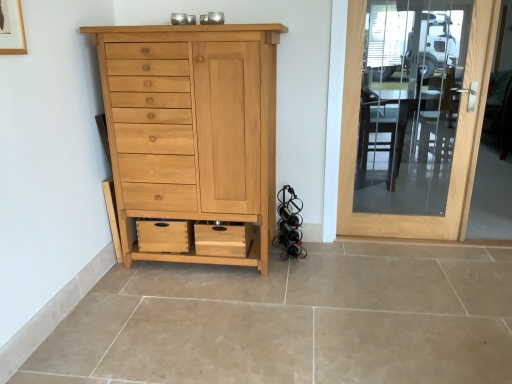
Question: Based on their sizes in the image, would you say clear glass door at right is bigger or smaller than natural wood cabinet at center?

Choices:
 (A) small
 (B) big

Answer: (A)

Question: From their relative heights in the image, would you say clear glass door at right is taller or shorter than natural wood cabinet at center?

Choices:
 (A) short
 (B) tall

Answer: (B)

Question: From the image's perspective, relative to natural wood cabinet at center, is clear glass door at right above or below?

Choices:
 (A) below
 (B) above

Answer: (B)

Question: Is natural wood cabinet at center to the left or to the right of clear glass door at right in the image?

Choices:
 (A) right
 (B) left

Answer: (B)

Question: Is natural wood cabinet at center in front of or behind clear glass door at right in the image?

Choices:
 (A) behind
 (B) front

Answer: (B)

Question: From their relative heights in the image, would you say natural wood cabinet at center is taller or shorter than clear glass door at right?

Choices:
 (A) short
 (B) tall

Answer: (A)

Question: Does point (218, 43) appear closer or farther from the camera than point (339, 221)?

Choices:
 (A) closer
 (B) farther

Answer: (A)